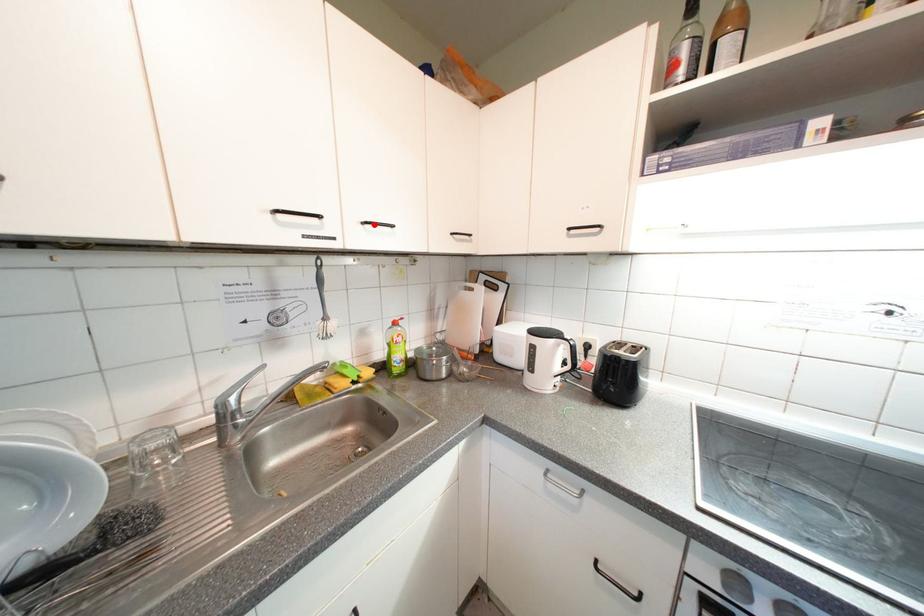
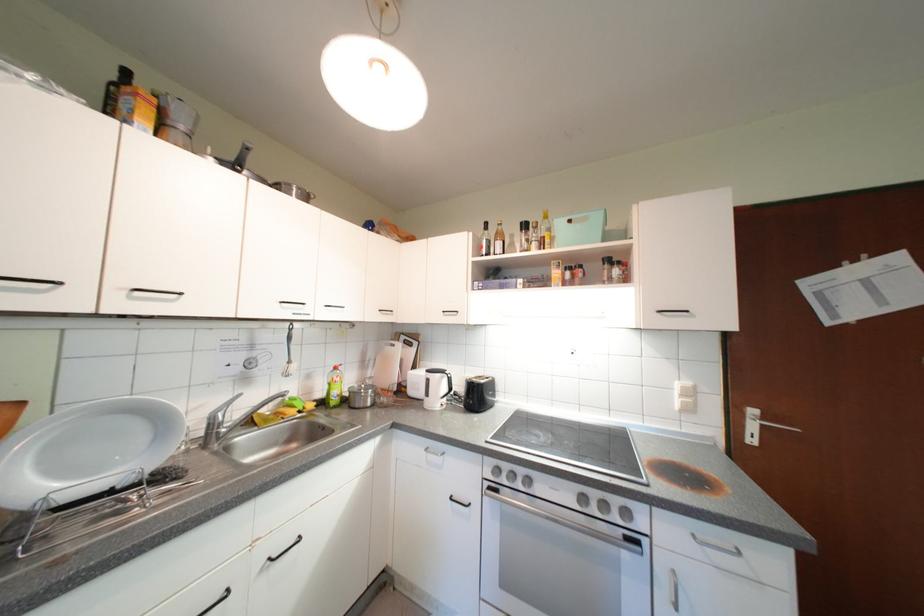
In the second image, find the point that corresponds to the highlighted location in the first image.

(335, 309)